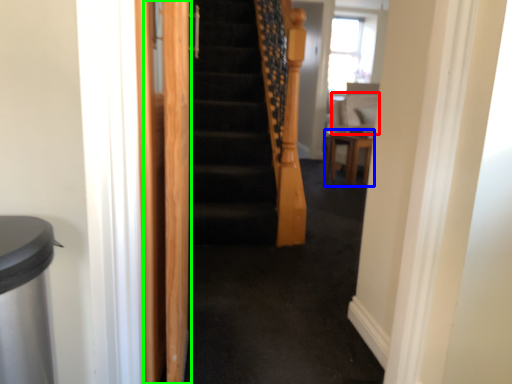
Question: Which object is positioned closest to sit (highlighted by a red box)? Select from furniture (highlighted by a blue box) and screen door (highlighted by a green box).

Choices:
 (A) furniture
 (B) screen door

Answer: (A)